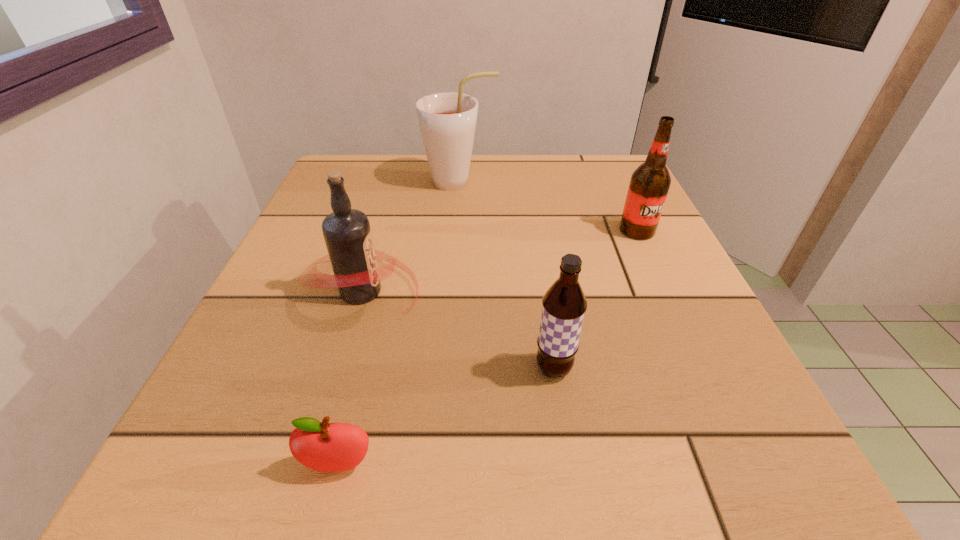
At what (x,y) coordinates should I click in order to perform the action: click on vacant space in between the farthest root beer and the nearest root beer. Please return your answer as a coordinate pair (x, y). The width and height of the screenshot is (960, 540). Looking at the image, I should click on (507, 275).

I want to click on free space between the second farthest root beer and the second nearest root beer, so click(500, 261).

Identify the location of free area in between the nearest object and the third farthest root beer. Image resolution: width=960 pixels, height=540 pixels. (350, 379).

In order to click on vacant region between the farthest root beer and the second farthest object in this screenshot , I will do `click(548, 206)`.

The image size is (960, 540). Identify the location of vacant space that's between the apple and the rightmost object. (488, 348).

The width and height of the screenshot is (960, 540). I want to click on free space between the third farthest root beer and the second object from right to left, so click(458, 330).

Where is `vacant area between the third root beer from left to right and the third farthest root beer`? This screenshot has height=540, width=960. vacant area between the third root beer from left to right and the third farthest root beer is located at coordinates (458, 330).

Select which object appears as the second closest to the third farthest object. Please provide its 2D coordinates. Your answer should be formatted as a tuple, i.e. [(x, y)], where the tuple contains the x and y coordinates of a point satisfying the conditions above.

[(329, 447)]

Identify which object is the nearest to the third farthest root beer. Please provide its 2D coordinates. Your answer should be formatted as a tuple, i.e. [(x, y)], where the tuple contains the x and y coordinates of a point satisfying the conditions above.

[(564, 305)]

Choose which root beer is the third nearest neighbor to the farthest root beer. Please provide its 2D coordinates. Your answer should be formatted as a tuple, i.e. [(x, y)], where the tuple contains the x and y coordinates of a point satisfying the conditions above.

[(564, 305)]